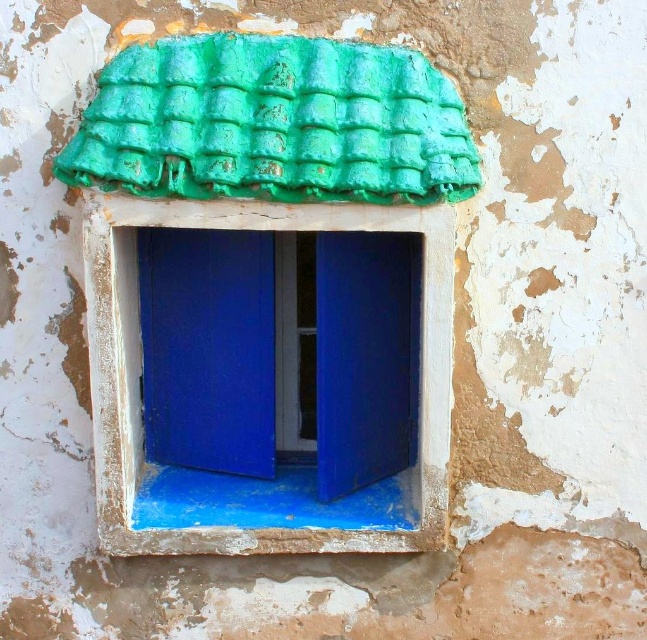
You are an architect inspecting a building facade. You notice the green textured tiles at upper center and the white painted wood at center. Which object is positioned higher on the wall?

The green textured tiles at upper center is positioned higher on the wall than the white painted wood at center.